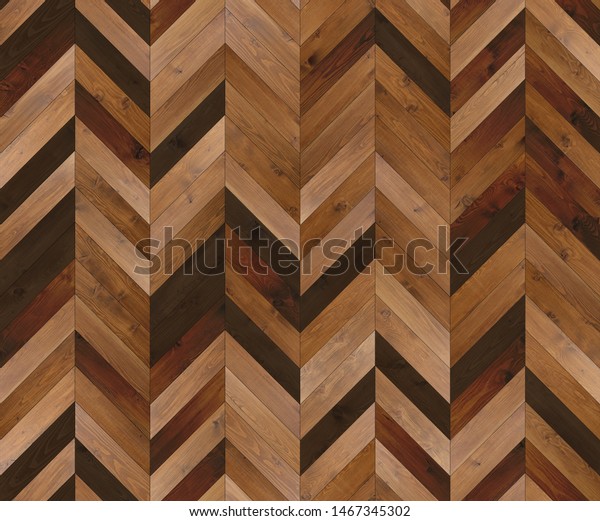
Find the location of a particular element. panel is located at coordinates (40, 325), (99, 315), (157, 318), (239, 315), (316, 325), (402, 330), (494, 337), (538, 339).